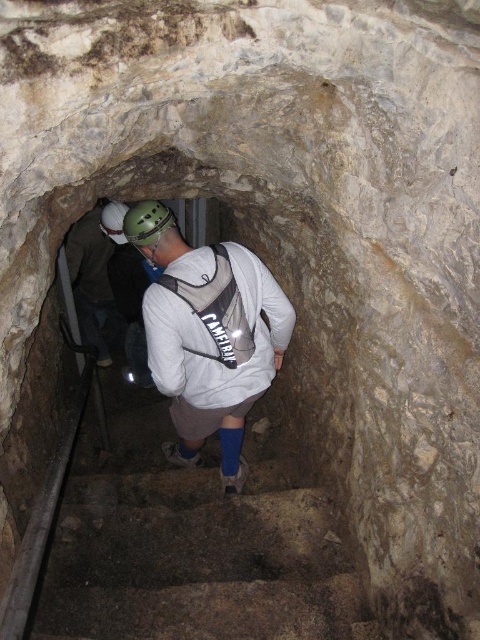
This screenshot has height=640, width=480. Describe the element at coordinates (195, 563) in the screenshot. I see `brown stone stairs at center` at that location.

The image size is (480, 640). I want to click on brown stone stairs at center, so click(x=195, y=563).

Image resolution: width=480 pixels, height=640 pixels. What do you see at coordinates (195, 563) in the screenshot?
I see `brown stone stairs at center` at bounding box center [195, 563].

Where is `brown stone stairs at center`? brown stone stairs at center is located at coordinates (195, 563).

Who is taller, brown stone stairs at center or white matte backpack at center?

With more height is white matte backpack at center.

Which is in front, point (81, 560) or point (189, 252)?

Point (189, 252) is in front.

Find the location of a particular element. The height and width of the screenshot is (640, 480). brown stone stairs at center is located at coordinates (195, 563).

Is brown stone stairs at center to the right of green matte helmet at center from the viewer's perspective?

Yes, brown stone stairs at center is to the right of green matte helmet at center.

Does brown stone stairs at center have a larger size compared to green matte helmet at center?

Yes, brown stone stairs at center is bigger than green matte helmet at center.

Does point (351, 566) come in front of point (169, 221)?

That is True.

I want to click on brown stone stairs at center, so click(195, 563).